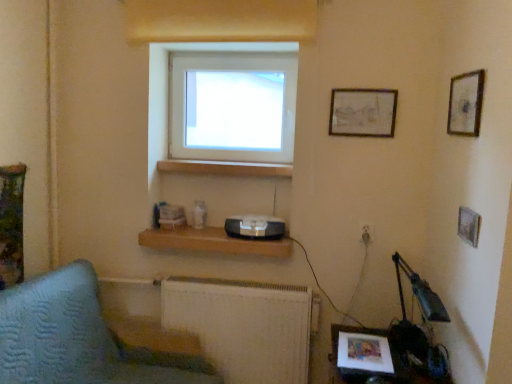
Identify the location of vacant space situated above transparent glass window at upper center (from a real-world perspective). (234, 54).